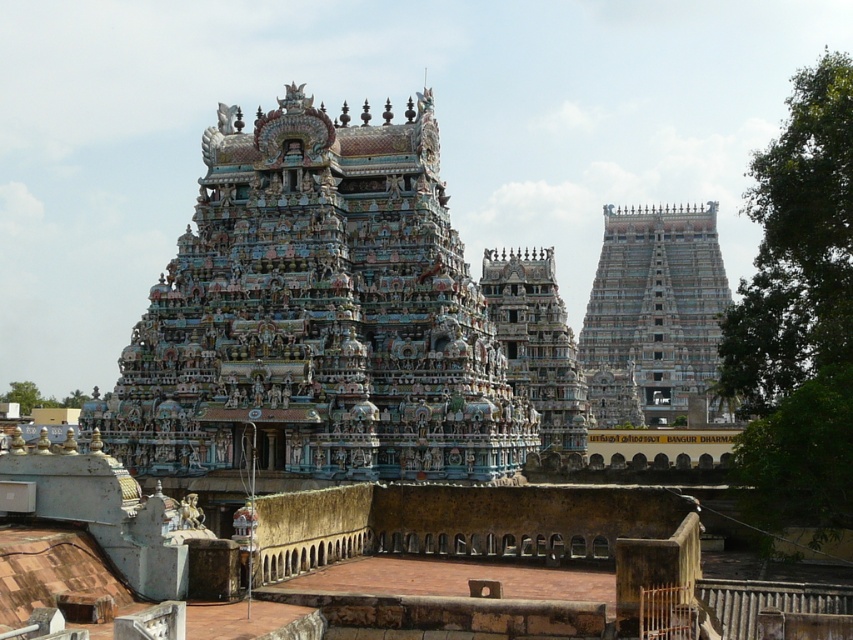
Question: Which point is closer to the camera?

Choices:
 (A) (537, 397)
 (B) (250, 451)

Answer: (B)

Question: Which object appears farthest from the camera in this image?

Choices:
 (A) blue stone temple at center
 (B) multicolored stone temple at center

Answer: (A)

Question: Does multicolored stone temple at center have a larger size compared to multicolored ornate temple at center?

Choices:
 (A) no
 (B) yes

Answer: (B)

Question: Does multicolored stone temple at center have a smaller size compared to blue stone temple at center?

Choices:
 (A) no
 (B) yes

Answer: (B)

Question: Which object is closer to the camera taking this photo?

Choices:
 (A) multicolored ornate temple at center
 (B) multicolored stone temple at center
 (C) blue stone temple at center

Answer: (B)

Question: Is multicolored stone temple at center to the right of blue stone temple at center from the viewer's perspective?

Choices:
 (A) no
 (B) yes

Answer: (A)